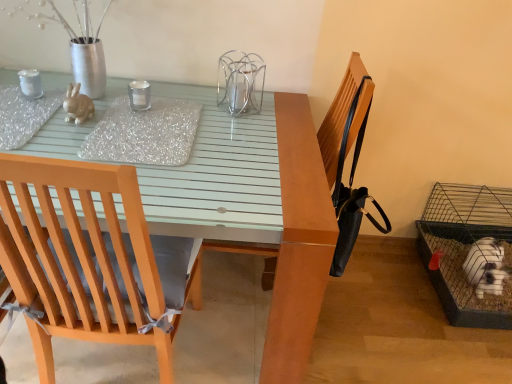
At what (x,y) coordinates should I click in order to perform the action: click on spots to the right of clear glass candle at center. Please return your answer as a coordinate pair (x, y). This screenshot has width=512, height=384. Looking at the image, I should click on (194, 110).